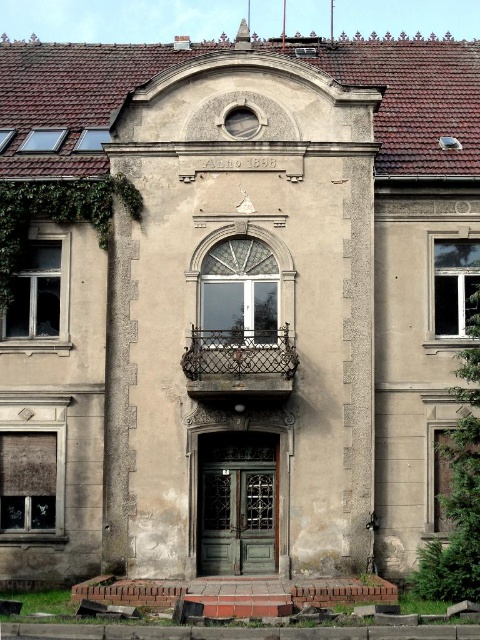
Does green ivy at right have a lesser width compared to rusty metal balcony at center?

Correct, green ivy at right's width is less than rusty metal balcony at center's.

Can you confirm if green ivy at right is shorter than rusty metal balcony at center?

No, green ivy at right is not shorter than rusty metal balcony at center.

Is point (454, 557) closer to viewer compared to point (220, 348)?

Yes.

Where is `green ivy at right`? This screenshot has height=640, width=480. green ivy at right is located at coordinates (458, 490).

From the picture: Can you confirm if green leafy ivy at left is positioned to the right of rusty metal balcony at center?

Incorrect, green leafy ivy at left is not on the right side of rusty metal balcony at center.

Looking at this image, between green leafy ivy at left and rusty metal balcony at center, which one has less height?

green leafy ivy at left is shorter.

Consider the image. Who is more forward, (104,244) or (201,349)?

Point (201,349) is in front.

The image size is (480, 640). Find the location of `green leafy ivy at left`. green leafy ivy at left is located at coordinates (56, 216).

Can you confirm if green ivy at right is positioned above green leafy ivy at left?

Actually, green ivy at right is below green leafy ivy at left.

Based on the photo, does green ivy at right come behind green leafy ivy at left?

No, it is not.

The image size is (480, 640). What do you see at coordinates (458, 490) in the screenshot?
I see `green ivy at right` at bounding box center [458, 490].

Image resolution: width=480 pixels, height=640 pixels. I want to click on green ivy at right, so click(x=458, y=490).